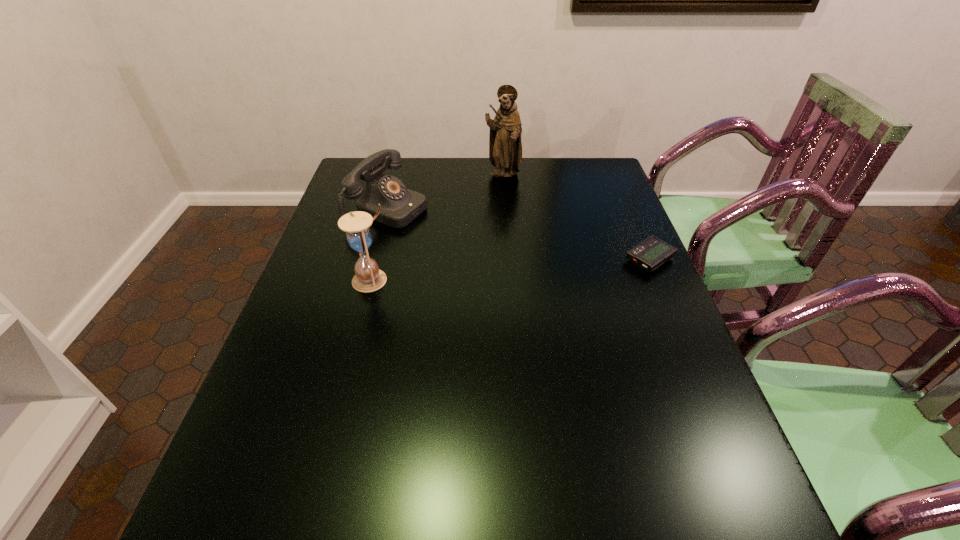
The height and width of the screenshot is (540, 960). Find the location of `the third shortest object`. the third shortest object is located at coordinates (368, 277).

Image resolution: width=960 pixels, height=540 pixels. Identify the location of the shortest object. pyautogui.click(x=651, y=253).

This screenshot has width=960, height=540. In order to click on beeper in this screenshot , I will do `click(651, 253)`.

This screenshot has height=540, width=960. I want to click on the second shortest object, so click(399, 206).

This screenshot has height=540, width=960. What are the coordinates of `the second farthest object` in the screenshot? It's located at [x=399, y=206].

Where is `figurine`? The image size is (960, 540). figurine is located at coordinates (505, 146).

At what (x,y) coordinates should I click in order to perform the action: click on the tallest object. Please return your answer as a coordinate pair (x, y). Looking at the image, I should click on pyautogui.click(x=505, y=146).

The width and height of the screenshot is (960, 540). Find the location of `free space located on the back of the third shortest object`. free space located on the back of the third shortest object is located at coordinates (391, 206).

Image resolution: width=960 pixels, height=540 pixels. I want to click on vacant region located on the left of the rightmost object, so click(580, 260).

I want to click on vacant space located 0.130m on the dial of the third tallest object, so click(456, 234).